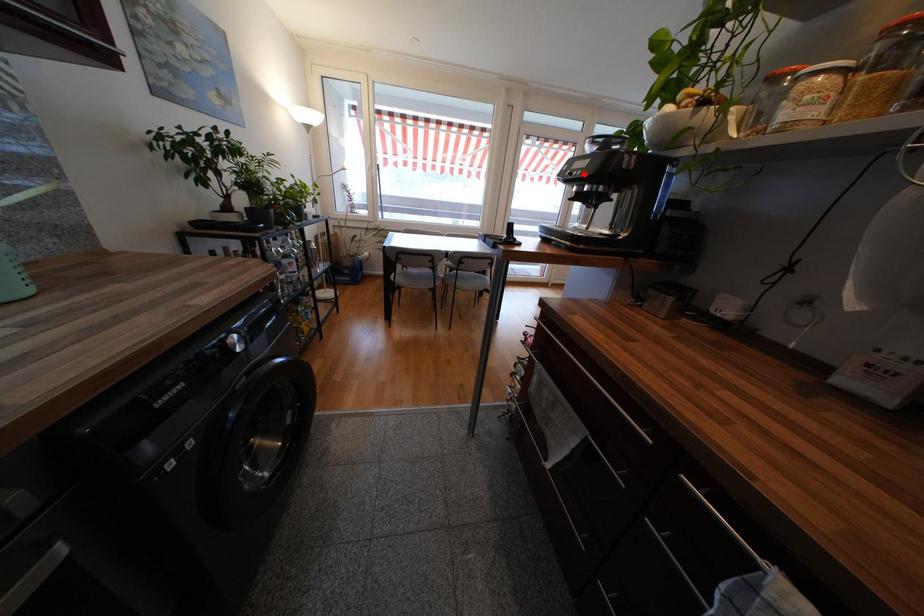
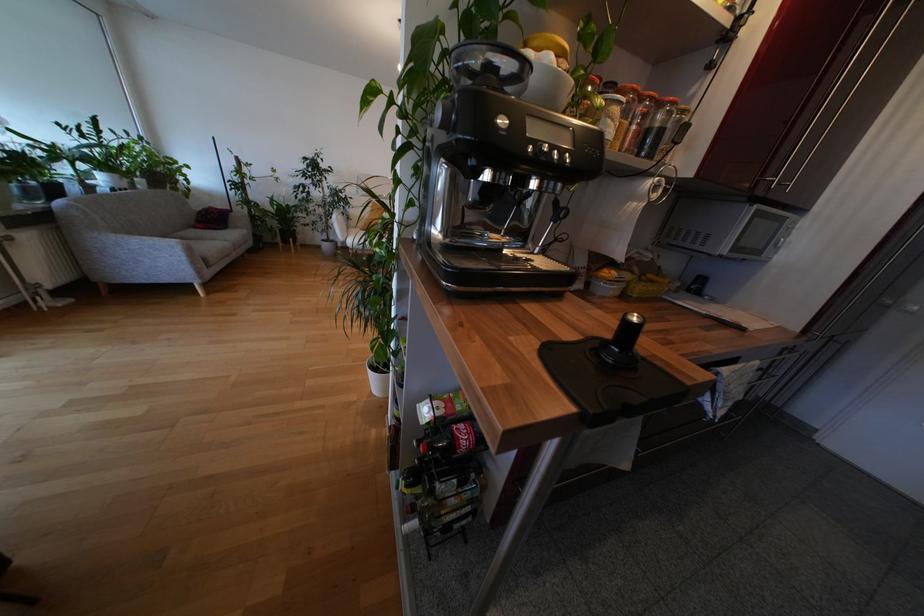
Locate, in the second image, the point that corresponds to the highlighted location in the first image.

(573, 159)